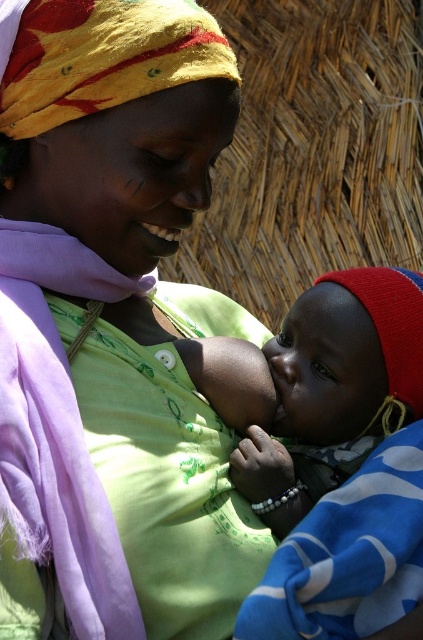
Is green matte shirt at center wider than soft blue fabric at center?

Correct, the width of green matte shirt at center exceeds that of soft blue fabric at center.

Who is more forward, (129,294) or (332,444)?

Point (332,444)

The height and width of the screenshot is (640, 423). What are the coordinates of `green matte shirt at center` in the screenshot? It's located at (112, 326).